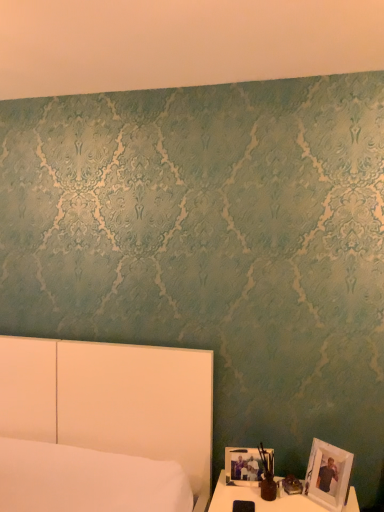
Question: Is white matte picture frame at lower right, the second picture frame viewed from the right, far from white wooden picture frame at lower right, which is the first picture frame from right to left?

Choices:
 (A) no
 (B) yes

Answer: (A)

Question: From a real-world perspective, does white matte picture frame at lower right, arranged as the first picture frame when viewed from the left, stand above white wooden picture frame at lower right, positioned as the second picture frame in left-to-right order?

Choices:
 (A) no
 (B) yes

Answer: (A)

Question: Is white matte picture frame at lower right, the second picture frame viewed from the right, shorter than white wooden picture frame at lower right, positioned as the second picture frame in left-to-right order?

Choices:
 (A) no
 (B) yes

Answer: (B)

Question: Does white matte picture frame at lower right, arranged as the first picture frame when viewed from the left, turn towards white wooden picture frame at lower right, which is the first picture frame from right to left?

Choices:
 (A) no
 (B) yes

Answer: (A)

Question: Is white matte picture frame at lower right, arranged as the first picture frame when viewed from the left, to the left of white wooden picture frame at lower right, positioned as the second picture frame in left-to-right order, from the viewer's perspective?

Choices:
 (A) yes
 (B) no

Answer: (A)

Question: Is white matte picture frame at lower right, arranged as the first picture frame when viewed from the left, with white wooden picture frame at lower right, positioned as the second picture frame in left-to-right order?

Choices:
 (A) yes
 (B) no

Answer: (B)

Question: Is white matte picture frame at lower right, arranged as the first picture frame when viewed from the left, positioned behind matte brown vase at lower right?

Choices:
 (A) yes
 (B) no

Answer: (A)

Question: From the image's perspective, is white matte picture frame at lower right, the second picture frame viewed from the right, under matte brown vase at lower right?

Choices:
 (A) yes
 (B) no

Answer: (A)

Question: Can we say white matte picture frame at lower right, the second picture frame viewed from the right, lies outside matte brown vase at lower right?

Choices:
 (A) no
 (B) yes

Answer: (B)

Question: From the image's perspective, is white matte picture frame at lower right, the second picture frame viewed from the right, on matte brown vase at lower right?

Choices:
 (A) no
 (B) yes

Answer: (A)

Question: From a real-world perspective, is white matte picture frame at lower right, the second picture frame viewed from the right, under matte brown vase at lower right?

Choices:
 (A) yes
 (B) no

Answer: (A)

Question: Is white matte picture frame at lower right, arranged as the first picture frame when viewed from the left, next to matte brown vase at lower right?

Choices:
 (A) no
 (B) yes

Answer: (B)

Question: Is white glossy table at lower right completely or partially outside of white matte picture frame at lower right, arranged as the first picture frame when viewed from the left?

Choices:
 (A) no
 (B) yes

Answer: (B)